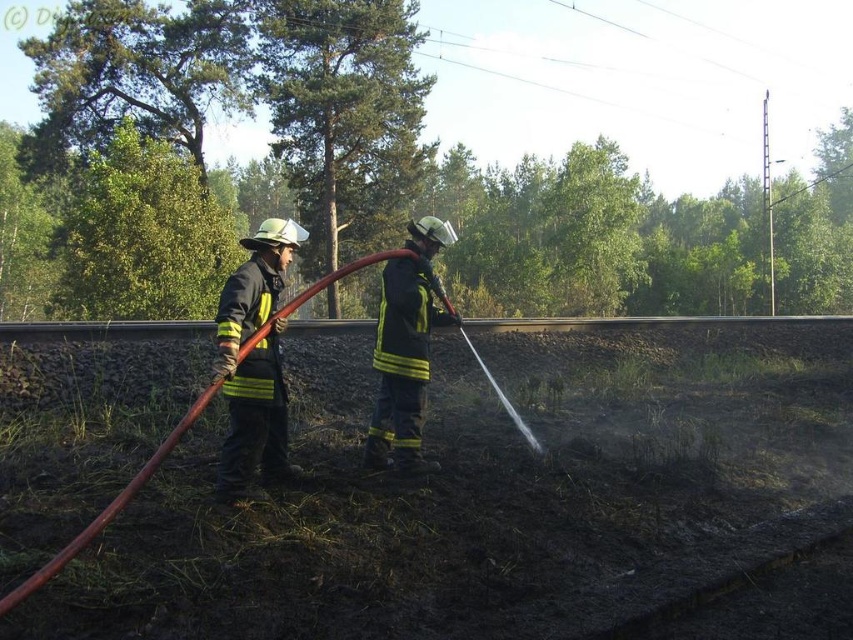
You are a drone operator trying to capture aerial footage of the fire scene. You have two points marked on your map, point A at coordinates point (271,356) and point B at coordinates point (412,282). Which point should you choose to get a clearer view of the firefighters and the extinguished fire area?

Point A at coordinates point (271,356) is in front of point B at coordinates point (412,282), so choosing point A would provide a clearer view of the firefighters and the extinguished fire area since it is positioned closer to the scene.

You are a drone operator trying to locate the reflective yellow jacket at center in an aerial view of the scene. What coordinates should you input to find it?

The reflective yellow jacket at center is located at coordinates point (254, 360).